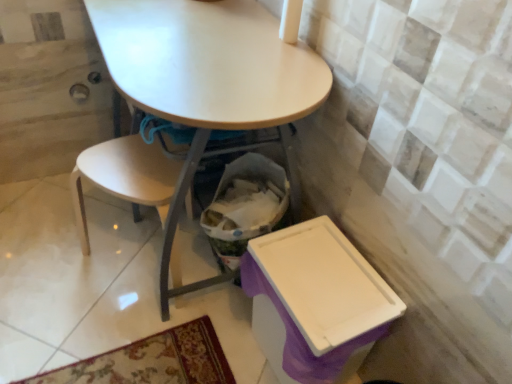
Find the location of a particular element. The width and height of the screenshot is (512, 384). vacant space underneath light wood chair at lower left (from a real-world perspective) is located at coordinates (121, 264).